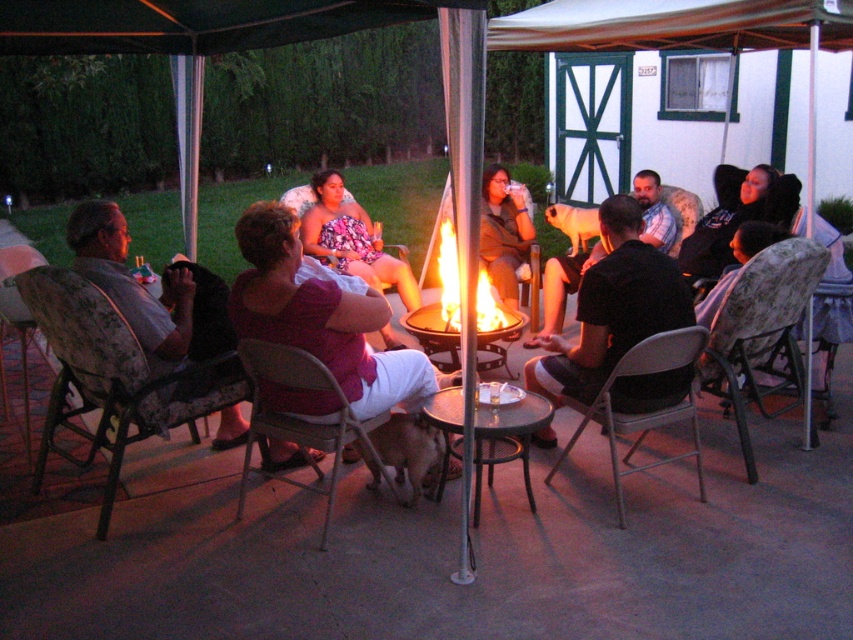
Consider the image. Who is more distant from viewer, (598, 401) or (711, 296)?

The point (711, 296) is behind.

Is metallic gray chair at lower right to the right of floral fabric chair at lower right from the viewer's perspective?

No, metallic gray chair at lower right is not to the right of floral fabric chair at lower right.

Which is behind, point (688, 397) or point (730, 241)?

The point (730, 241) is behind.

You are a GUI agent. You are given a task and a screenshot of the screen. Output one action in this format:
    pyautogui.click(x=<x>, y=<y>)
    Task: Click on the metallic gray chair at lower right
    The image size is (853, 640).
    Given the screenshot: What is the action you would take?
    pyautogui.click(x=643, y=410)

Between point (209, 385) and point (537, 372), which one is positioned in front?

Point (209, 385)

Can you confirm if floral fabric chair at left is positioned to the left of matte black shirt at center?

Correct, you'll find floral fabric chair at left to the left of matte black shirt at center.

The image size is (853, 640). Describe the element at coordinates (109, 374) in the screenshot. I see `floral fabric chair at left` at that location.

You are a GUI agent. You are given a task and a screenshot of the screen. Output one action in this format:
    pyautogui.click(x=<x>, y=<y>)
    Task: Click on the floral fabric chair at left
    
    Given the screenshot: What is the action you would take?
    pyautogui.click(x=109, y=374)

Is point (802, 310) farther from viewer compared to point (277, 381)?

Yes, it is behind point (277, 381).

Who is taller, patterned fabric chair at center or metallic gray chair at center?

patterned fabric chair at center

Between point (752, 387) and point (263, 371), which one is positioned in front?

Positioned in front is point (263, 371).

At what (x,y) coordinates should I click in order to perform the action: click on patterned fabric chair at center. Please return your answer as a coordinate pair (x, y). This screenshot has width=853, height=640. Looking at the image, I should click on (759, 330).